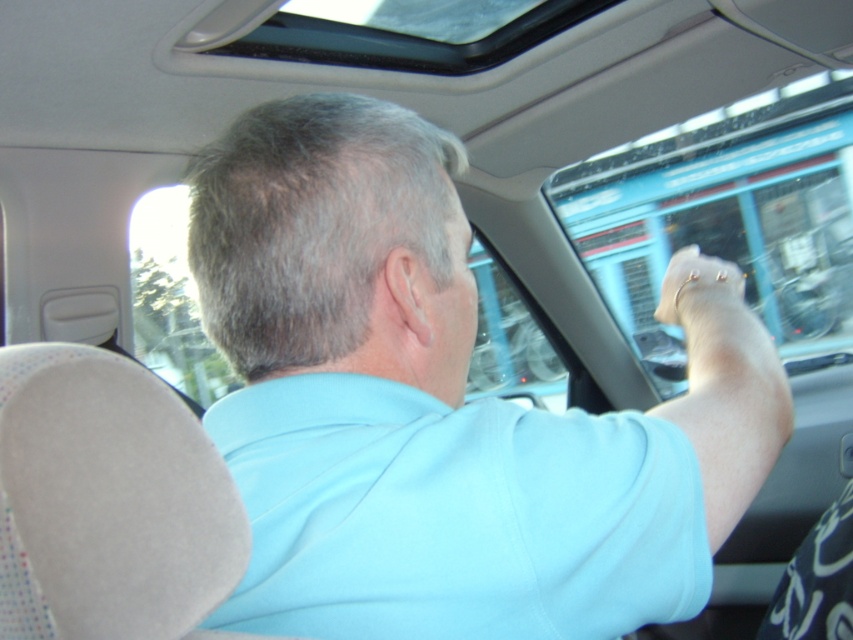
Question: Which object is farther from the camera taking this photo?

Choices:
 (A) gold metallic bracelet at upper center
 (B) transparent glass window at upper center
 (C) light blue cotton shirt at upper center

Answer: (B)

Question: Which of the following is the closest to the observer?

Choices:
 (A) (515, 349)
 (B) (635, 260)
 (C) (343, 225)

Answer: (C)

Question: Can you confirm if transparent glass window at upper center is bigger than gold metallic bracelet at upper center?

Choices:
 (A) no
 (B) yes

Answer: (B)

Question: Does light blue shirt at center have a smaller size compared to transparent glass window at upper left?

Choices:
 (A) no
 (B) yes

Answer: (A)

Question: Based on their relative distances, which object is farther from the transparent glass window at upper center?

Choices:
 (A) light blue shirt at center
 (B) light blue cotton shirt at upper center
 (C) transparent glass window at upper left

Answer: (B)

Question: Does light blue cotton shirt at upper center have a smaller size compared to transparent glass window at upper left?

Choices:
 (A) no
 (B) yes

Answer: (B)